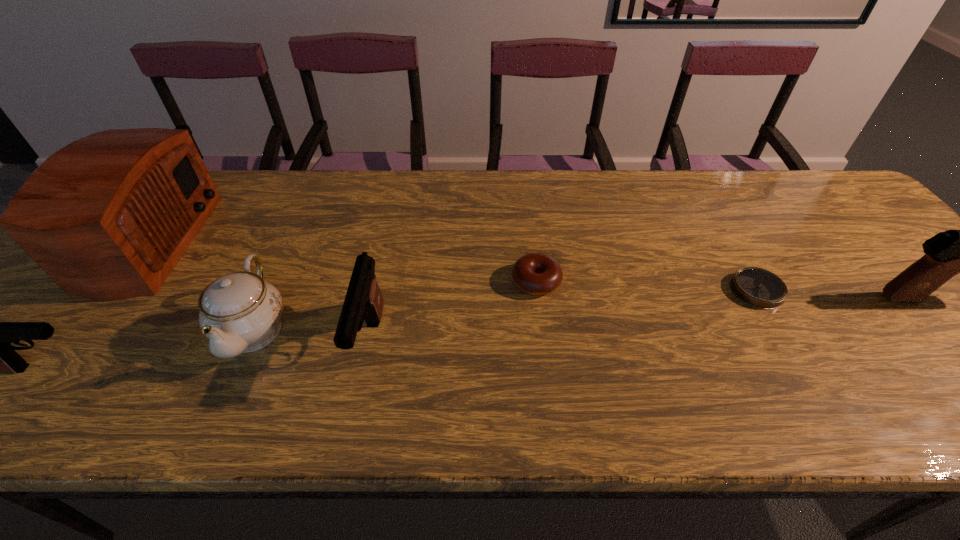
Find the location of a particular element. The image size is (960, 540). unoccupied position between the compass and the sixth tallest object is located at coordinates (646, 286).

The width and height of the screenshot is (960, 540). In order to click on free area in between the sixth tallest object and the second shortest pistol in this screenshot , I will do `click(453, 312)`.

In order to click on free space between the radio receiver and the chinaware in this screenshot , I will do `click(197, 285)`.

Locate an element on the screen. The image size is (960, 540). object identified as the sixth closest to the second shortest pistol is located at coordinates (948, 253).

Where is `object identified as the third closest to the radio receiver`? The width and height of the screenshot is (960, 540). object identified as the third closest to the radio receiver is located at coordinates (363, 300).

This screenshot has height=540, width=960. What are the coordinates of `the third closest pistol to the sixth tallest object` in the screenshot? It's located at (0, 356).

Locate which pistol ranks third in proximity to the compass. Please provide its 2D coordinates. Your answer should be formatted as a tuple, i.e. [(x, y)], where the tuple contains the x and y coordinates of a point satisfying the conditions above.

[(0, 356)]

The image size is (960, 540). Identify the location of vacant position in the image that satisfies the following two spatial constraints: 1. on the front-facing side of the third object from right to left; 2. on the right side of the tallest object. (107, 281).